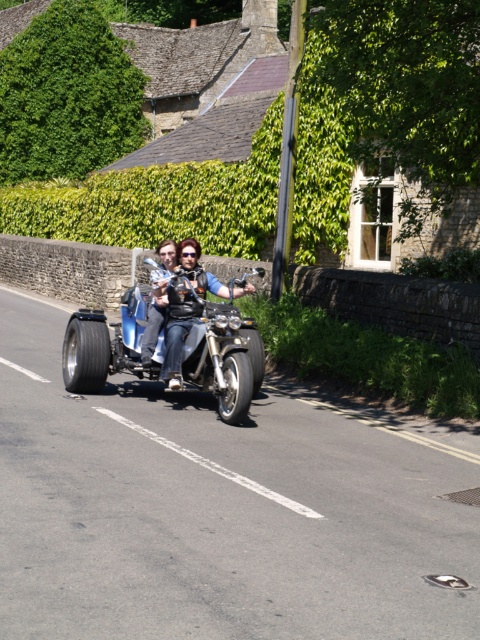
Based on the photo, between green leafy hedge at upper left and leather jacket at center, which one is positioned higher?

green leafy hedge at upper left is above.

Which is in front, point (25, 168) or point (176, 378)?

Point (176, 378) is more forward.

You are a GUI agent. You are given a task and a screenshot of the screen. Output one action in this format:
    pyautogui.click(x=<x>, y=<y>)
    Task: Click on the green leafy hedge at upper left
    
    Given the screenshot: What is the action you would take?
    pyautogui.click(x=67, y=97)

Can you confirm if green leafy hedge at upper left is positioned below shiny chrome motorcycle at center?

Incorrect, green leafy hedge at upper left is not positioned below shiny chrome motorcycle at center.

Is point (67, 164) less distant than point (223, 307)?

No, it is behind (223, 307).

Between point (139, 145) and point (207, 326), which one is positioned behind?

Positioned behind is point (139, 145).

Where is `green leafy hedge at upper left`? The width and height of the screenshot is (480, 640). green leafy hedge at upper left is located at coordinates (67, 97).

Who is taller, shiny chrome motorcycle at center or leather jacket at center?

Standing taller between the two is leather jacket at center.

Which is more to the right, shiny chrome motorcycle at center or leather jacket at center?

From the viewer's perspective, leather jacket at center appears more on the right side.

The height and width of the screenshot is (640, 480). Identify the location of shiny chrome motorcycle at center. (224, 358).